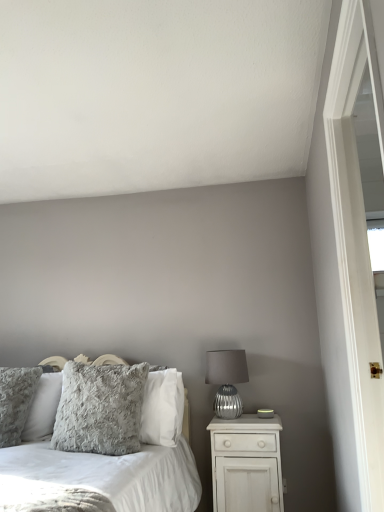
I want to click on white wooden screen door at right, so click(356, 238).

Describe the element at coordinates (246, 464) in the screenshot. I see `white matte nightstand at lower right` at that location.

Measure the distance between point (167, 485) and camera.

The distance of point (167, 485) from camera is 2.03 meters.

Find the location of a particular element. fluffy gray pillow at left, which is counted as the 1th pillow, starting from the left is located at coordinates [x=16, y=401].

I want to click on white wooden screen door at right, so click(356, 238).

In terms of size, does white wooden screen door at right appear bigger or smaller than fluffy gray pillow at left, arranged as the second pillow when viewed from the right?

Considering their sizes, white wooden screen door at right takes up more space than fluffy gray pillow at left, arranged as the second pillow when viewed from the right.

From a real-world perspective, is white wooden screen door at right located beneath fluffy gray pillow at left, which is counted as the 1th pillow, starting from the left?

No, from a real-world perspective, white wooden screen door at right is not beneath fluffy gray pillow at left, which is counted as the 1th pillow, starting from the left.

Could you tell me if white wooden screen door at right is turned towards fluffy gray pillow at left, which is counted as the 1th pillow, starting from the left?

No, white wooden screen door at right is not facing towards fluffy gray pillow at left, which is counted as the 1th pillow, starting from the left.

Which object is more forward, white wooden screen door at right or fluffy gray pillow at left, which is counted as the 1th pillow, starting from the left?

white wooden screen door at right is more forward.

Considering the positions of point (363, 505) and point (230, 394), is point (363, 505) closer or farther from the camera than point (230, 394)?

Clearly, point (363, 505) is closer to the camera than point (230, 394).

Is white wooden screen door at right further to camera compared to matte silver glass table lamp at right?

No, the depth of white wooden screen door at right is less than that of matte silver glass table lamp at right.

In the scene shown: From the image's perspective, is white wooden screen door at right above or below matte silver glass table lamp at right?

Based on their image positions, white wooden screen door at right is located above matte silver glass table lamp at right.

Is white wooden screen door at right positioned beyond the bounds of matte silver glass table lamp at right?

Yes, white wooden screen door at right is not within matte silver glass table lamp at right.

Based on their positions, is fluffy gray pillow at center, the first pillow when ordered from right to left, located to the left or right of fluffy gray pillows at left?

fluffy gray pillow at center, the first pillow when ordered from right to left, is to the right of fluffy gray pillows at left.

From a real-world perspective, is fluffy gray pillow at center, the first pillow when ordered from right to left, on fluffy gray pillows at left?

Indeed, from a real-world perspective, fluffy gray pillow at center, the first pillow when ordered from right to left, stands above fluffy gray pillows at left.

Identify the location of the 1st pillow above the fluffy gray pillows at left (from a real-world perspective). The image size is (384, 512). (100, 409).

Based on their sizes in the image, would you say fluffy gray pillow at center, the first pillow when ordered from right to left, is bigger or smaller than fluffy gray pillows at left?

In the image, fluffy gray pillow at center, the first pillow when ordered from right to left, appears to be smaller than fluffy gray pillows at left.

Is point (76, 418) closer or farther from the camera than point (228, 459)?

Point (76, 418).

In the image, is fluffy gray pillow at center, the second pillow when ordered from left to right, positioned in front of or behind white matte nightstand at lower right?

Visually, fluffy gray pillow at center, the second pillow when ordered from left to right, is located in front of white matte nightstand at lower right.

Which object is positioned more to the left, fluffy gray pillow at center, the second pillow when ordered from left to right, or white matte nightstand at lower right?

Positioned to the left is fluffy gray pillow at center, the second pillow when ordered from left to right.

Measure the distance between fluffy gray pillow at center, the second pillow when ordered from left to right, and white matte nightstand at lower right.

They are 25.26 inches apart.

Is matte silver glass table lamp at right positioned in front of white matte nightstand at lower right?

Answer: No, it is not.

Can you confirm if matte silver glass table lamp at right is bigger than white matte nightstand at lower right?

No.

The height and width of the screenshot is (512, 384). What are the coordinates of `nightstand that appears on the right of matte silver glass table lamp at right` in the screenshot? It's located at (246, 464).

From the image's perspective, would you say white wooden screen door at right is shown under fluffy gray pillows at left?

No, from the image's perspective, white wooden screen door at right is not beneath fluffy gray pillows at left.

Identify the location of screen door that is on the right side of fluffy gray pillows at left. The width and height of the screenshot is (384, 512). (356, 238).

In the scene shown: From a real-world perspective, is white wooden screen door at right above or below fluffy gray pillows at left?

Clearly, from a real-world perspective, white wooden screen door at right is above fluffy gray pillows at left.

Looking at this image, between white wooden screen door at right and fluffy gray pillows at left, which one is positioned behind?

white wooden screen door at right.

Is fluffy gray pillow at center, the first pillow when ordered from right to left, to the left or to the right of white wooden screen door at right in the image?

Based on their positions, fluffy gray pillow at center, the first pillow when ordered from right to left, is located to the left of white wooden screen door at right.

Is fluffy gray pillow at center, the second pillow when ordered from left to right, beside white wooden screen door at right?

No, fluffy gray pillow at center, the second pillow when ordered from left to right, is not next to white wooden screen door at right.

Does fluffy gray pillow at center, the first pillow when ordered from right to left, have a lesser height compared to white wooden screen door at right?

Correct, fluffy gray pillow at center, the first pillow when ordered from right to left, is not as tall as white wooden screen door at right.

Would you say fluffy gray pillow at center, the second pillow when ordered from left to right, is inside or outside white wooden screen door at right?

fluffy gray pillow at center, the second pillow when ordered from left to right, is spatially situated outside white wooden screen door at right.

From the white wooden screen door at right, count 2nd pillows backward and point to it. Please provide its 2D coordinates.

[(16, 401)]

Identify the location of screen door in front of the matte silver glass table lamp at right. (356, 238).

Estimate the real-world distances between objects in this image. Which object is closer to fluffy gray pillows at left, white wooden screen door at right or fluffy gray pillow at center, the second pillow when ordered from left to right?

fluffy gray pillow at center, the second pillow when ordered from left to right.

Estimate the real-world distances between objects in this image. Which object is further from fluffy gray pillows at left, fluffy gray pillow at left, arranged as the second pillow when viewed from the right, or fluffy gray pillow at center, the first pillow when ordered from right to left?

Among the two, fluffy gray pillow at left, arranged as the second pillow when viewed from the right, is located further to fluffy gray pillows at left.

In the scene shown: Considering their positions, is white matte nightstand at lower right positioned closer to fluffy gray pillows at left than matte silver glass table lamp at right?

white matte nightstand at lower right is positioned closer to the anchor fluffy gray pillows at left.

When comparing their distances from white wooden screen door at right, does matte silver glass table lamp at right or fluffy gray pillow at left, which is counted as the 1th pillow, starting from the left, seem closer?

matte silver glass table lamp at right lies closer to white wooden screen door at right than the other object.

From the image, which object appears to be farther from fluffy gray pillow at left, arranged as the second pillow when viewed from the right, fluffy gray pillow at center, the second pillow when ordered from left to right, or white wooden screen door at right?

Based on the image, white wooden screen door at right appears to be further to fluffy gray pillow at left, arranged as the second pillow when viewed from the right.

Estimate the real-world distances between objects in this image. Which object is further from fluffy gray pillow at left, arranged as the second pillow when viewed from the right, fluffy gray pillow at center, the first pillow when ordered from right to left, or fluffy gray pillows at left?

fluffy gray pillows at left lies further to fluffy gray pillow at left, arranged as the second pillow when viewed from the right, than the other object.

Considering their positions, is white wooden screen door at right positioned further to fluffy gray pillow at center, the first pillow when ordered from right to left, than matte silver glass table lamp at right?

white wooden screen door at right lies further to fluffy gray pillow at center, the first pillow when ordered from right to left, than the other object.

Estimate the real-world distances between objects in this image. Which object is closer to fluffy gray pillows at left, white matte nightstand at lower right or fluffy gray pillow at left, arranged as the second pillow when viewed from the right?

white matte nightstand at lower right is positioned closer to the anchor fluffy gray pillows at left.

Find the location of a particular element. The height and width of the screenshot is (512, 384). nightstand located between white wooden screen door at right and matte silver glass table lamp at right in the depth direction is located at coordinates (246, 464).

Identify the location of screen door between fluffy gray pillows at left and fluffy gray pillow at left, which is counted as the 1th pillow, starting from the left, in the front-back direction. (356, 238).

In order to click on nightstand between white wooden screen door at right and fluffy gray pillow at left, which is counted as the 1th pillow, starting from the left, in the front-back direction in this screenshot , I will do `click(246, 464)`.

Identify the location of pillow positioned between white wooden screen door at right and fluffy gray pillow at left, which is counted as the 1th pillow, starting from the left, from near to far. The width and height of the screenshot is (384, 512). (100, 409).